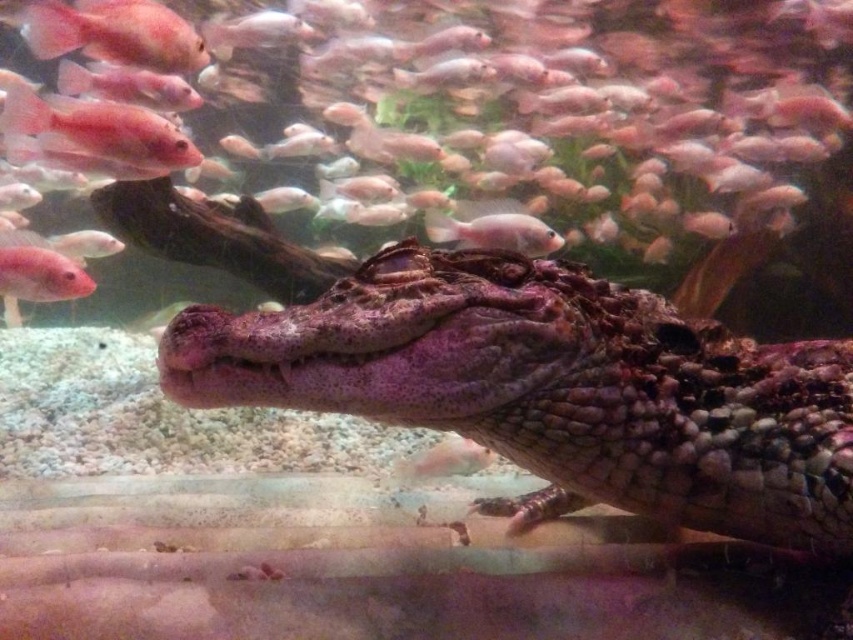
You are an aquarium maintenance worker who needs to place a 3.5 feet long net between the pink matte fish at left and the pink glossy fish at center. Is there enough space to fit the net without disturbing the fish?

The distance between the pink matte fish at left and the pink glossy fish at center is 4.05 feet, so yes, the 3.5 feet net can be placed between them as there is sufficient space.

You are an aquatic biologist observing the purple scaly crocodile at center and the pink matte fish at left in an aquarium. Which of the two has a larger body size?

The purple scaly crocodile at center is larger in size than the pink matte fish at left.

From the picture: You are an aquarium guide. A visitor asks where the purple scaly crocodile at center is located in the tank. Use coordinates to describe its position.

The purple scaly crocodile at center is located at coordinates point (554, 387) in the tank.